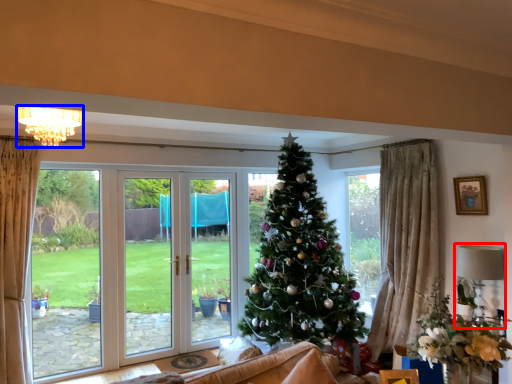
Question: Which of the following is the closest to the observer, lamp (highlighted by a red box) or light (highlighted by a blue box)?

Choices:
 (A) lamp
 (B) light

Answer: (B)